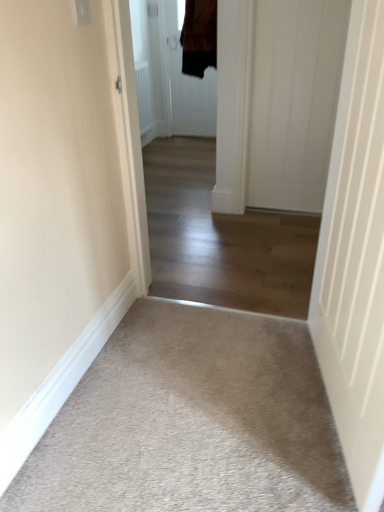
Question: From their relative heights in the image, would you say white smooth door at right, the 1th door from the front, is taller or shorter than light beige carpet at center?

Choices:
 (A) short
 (B) tall

Answer: (B)

Question: Based on their sizes in the image, would you say white smooth door at right, the second door when ordered from left to right, is bigger or smaller than light beige carpet at center?

Choices:
 (A) small
 (B) big

Answer: (A)

Question: Estimate the real-world distances between objects in this image. Which object is farther from the white smooth door at right, which is the 3th door in top-to-bottom order?

Choices:
 (A) brown fabric door at center, the 1th door when ordered from top to bottom
 (B) white smooth door at right, arranged as the 2th door when viewed from the top
 (C) light beige carpet at center
 (D) beige carpet at lower left
 (E) brown suede jacket at upper center

Answer: (A)

Question: Which of these objects is positioned farthest from the light beige carpet at center?

Choices:
 (A) beige carpet at lower left
 (B) white smooth door at right, the third door in the left-to-right sequence
 (C) white smooth door at right, the third door positioned from the back
 (D) brown suede jacket at upper center
 (E) brown fabric door at center, the first door positioned from the back

Answer: (E)